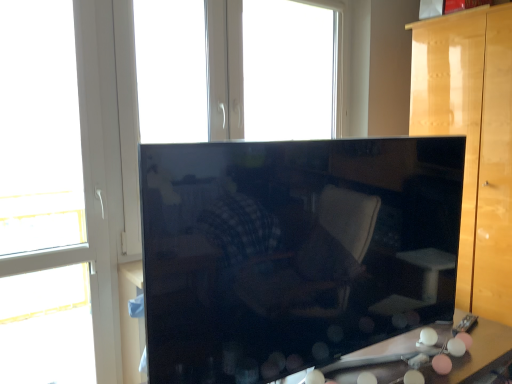
Question: Is white plastic window at upper center, the 2th window when ordered from left to right, at the back of matte plastic table at lower right?

Choices:
 (A) yes
 (B) no

Answer: (B)

Question: Is white plastic window at upper center, the 2th window when ordered from left to right, inside matte plastic table at lower right?

Choices:
 (A) no
 (B) yes

Answer: (A)

Question: From a real-world perspective, is matte plastic table at lower right on top of white plastic window at upper center, the 2th window when ordered from left to right?

Choices:
 (A) yes
 (B) no

Answer: (B)

Question: Is matte plastic table at lower right directly adjacent to white plastic window at upper center, which is the second window in front-to-back order?

Choices:
 (A) no
 (B) yes

Answer: (A)

Question: Can you confirm if matte plastic table at lower right is wider than white plastic window at upper center, the 1th window from the back?

Choices:
 (A) yes
 (B) no

Answer: (B)

Question: Considering the relative sizes of matte plastic table at lower right and white plastic window at upper center, which is the second window in front-to-back order, in the image provided, is matte plastic table at lower right smaller than white plastic window at upper center, which is the second window in front-to-back order,?

Choices:
 (A) no
 (B) yes

Answer: (B)

Question: Is glossy wood cabinet at right bigger than white plastic window at left, the 1th window from the left?

Choices:
 (A) yes
 (B) no

Answer: (A)

Question: Is glossy wood cabinet at right further to camera compared to white plastic window at left, the 1th window from the left?

Choices:
 (A) no
 (B) yes

Answer: (B)

Question: Is glossy wood cabinet at right outside white plastic window at left, which is the 2th window in back-to-front order?

Choices:
 (A) no
 (B) yes

Answer: (B)

Question: Are glossy wood cabinet at right and white plastic window at left, the 1th window from the left, located far from each other?

Choices:
 (A) no
 (B) yes

Answer: (B)

Question: Can you confirm if glossy wood cabinet at right is smaller than white plastic window at left, which is the 2th window in back-to-front order?

Choices:
 (A) no
 (B) yes

Answer: (A)

Question: Is glossy wood cabinet at right thinner than white plastic window at left, the 1th window from the left?

Choices:
 (A) no
 (B) yes

Answer: (A)

Question: Is white plastic window at upper center, placed as the first window when sorted from right to left, far away from white plastic window at left, the 1th window from the left?

Choices:
 (A) yes
 (B) no

Answer: (A)